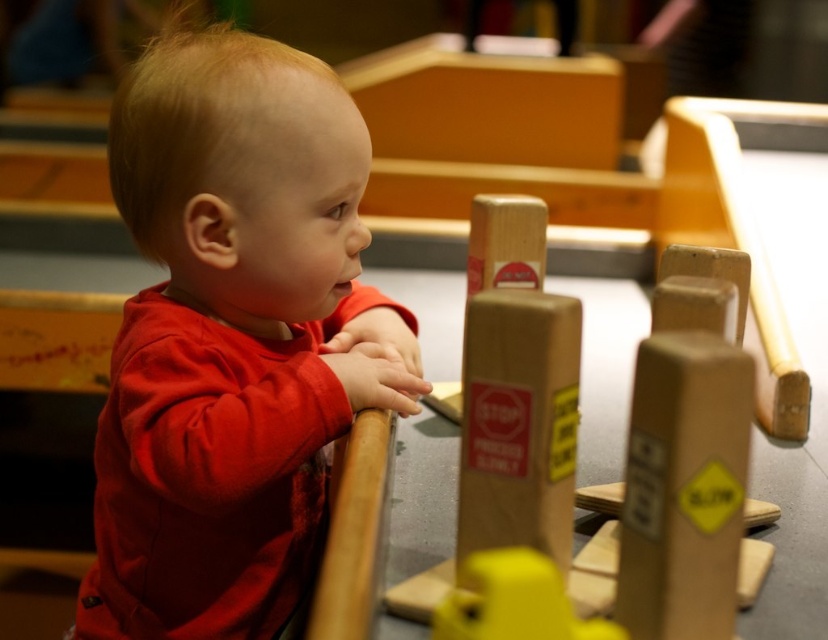
You are a photographer setting up a shot of the child and the wooden sign. To ensure both the red matte shirt at left and the wooden sign at center are in focus, where should you position the camera focus point?

The red matte shirt at left is located below the wooden sign at center. To have both in focus, the focus point should be placed between them, closer to the wooden sign at center since it is higher up.

You are a photographer trying to capture a closeup of the child in the scene. The camera is currently focused on the point at coordinates point (337, 147). If the camera requires the subject to be at least 36 inches away to avoid blurring, will the current focus point work?

The point (337, 147) is 35.76 inches away from the camera, which is less than the required 36 inches. Therefore, the current focus point may cause blurring and is not suitable for a sharp closeup.